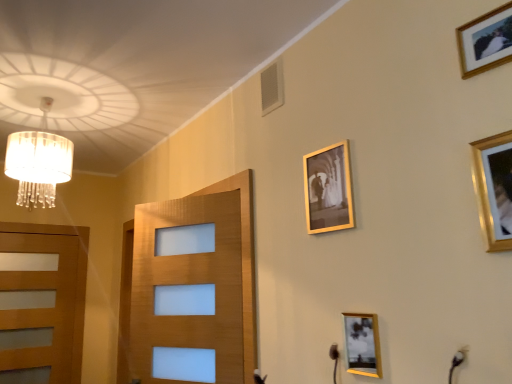
Question: Is wooden door at left positioned with its back to gold-framed photo at upper right, the third picture frame in the back-to-front sequence?

Choices:
 (A) no
 (B) yes

Answer: (A)

Question: Considering the relative sizes of wooden door at left and gold-framed photo at upper right, the third picture frame in the back-to-front sequence, in the image provided, is wooden door at left wider than gold-framed photo at upper right, the third picture frame in the back-to-front sequence,?

Choices:
 (A) no
 (B) yes

Answer: (B)

Question: From the image's perspective, is wooden door at left on gold-framed photo at upper right, arranged as the third picture frame when viewed from the left?

Choices:
 (A) no
 (B) yes

Answer: (A)

Question: Does wooden door at left lie behind gold-framed photo at upper right, arranged as the 2th picture frame when viewed from the front?

Choices:
 (A) yes
 (B) no

Answer: (A)

Question: From the image's perspective, is wooden door at left located beneath gold-framed photo at upper right, marked as the 4th picture frame in a bottom-to-top arrangement?

Choices:
 (A) no
 (B) yes

Answer: (B)

Question: From the image's perspective, is gold metallic picture frame at upper center, which ranks as the 1th picture frame in back-to-front order, positioned above or below translucent glass chandelier at upper left?

Choices:
 (A) above
 (B) below

Answer: (B)

Question: Considering their positions, is gold metallic picture frame at upper center, which is counted as the 4th picture frame, starting from the right, located in front of or behind translucent glass chandelier at upper left?

Choices:
 (A) behind
 (B) front

Answer: (B)

Question: In the image, is gold metallic picture frame at upper center, which ranks as the 1th picture frame in back-to-front order, on the left side or the right side of translucent glass chandelier at upper left?

Choices:
 (A) left
 (B) right

Answer: (B)

Question: Looking at the image, does gold metallic picture frame at upper center, which appears as the fourth picture frame when viewed from the front, seem bigger or smaller compared to translucent glass chandelier at upper left?

Choices:
 (A) small
 (B) big

Answer: (A)

Question: From a real-world perspective, is gold-framed photo at lower right, the fourth picture frame in the top-to-bottom sequence, positioned above or below gold metallic picture frame at upper right, placed as the 4th picture frame when sorted from left to right?

Choices:
 (A) above
 (B) below

Answer: (B)

Question: In terms of size, does gold-framed photo at lower right, acting as the 3th picture frame starting from the right, appear bigger or smaller than gold metallic picture frame at upper right, arranged as the first picture frame when viewed from the front?

Choices:
 (A) big
 (B) small

Answer: (B)

Question: Is gold-framed photo at lower right, the fourth picture frame in the top-to-bottom sequence, wider or thinner than gold metallic picture frame at upper right, the 4th picture frame positioned from the back?

Choices:
 (A) thin
 (B) wide

Answer: (B)

Question: From the image's perspective, is gold-framed photo at lower right, the first picture frame from the bottom, located above or below gold metallic picture frame at upper right, arranged as the first picture frame when viewed from the front?

Choices:
 (A) above
 (B) below

Answer: (B)

Question: Relative to gold-framed photo at lower right, the second picture frame viewed from the back, is translucent glass chandelier at upper left in front or behind?

Choices:
 (A) behind
 (B) front

Answer: (A)

Question: From the image's perspective, is translucent glass chandelier at upper left located above or below gold-framed photo at lower right, the first picture frame from the bottom?

Choices:
 (A) below
 (B) above

Answer: (B)